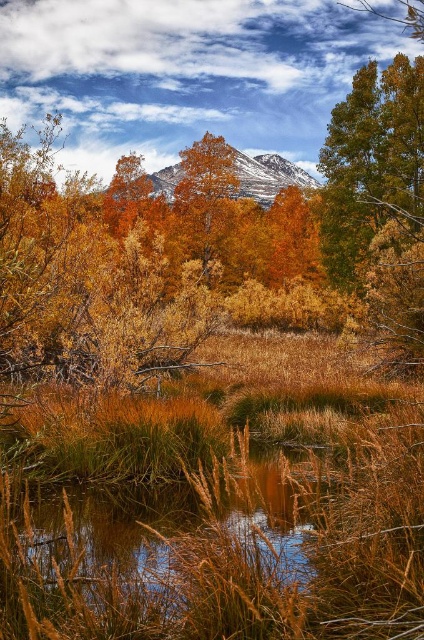
You are planning to take a photo of the golden textured tree at center and the snowy rock mountain at upper center. Since you want both subjects to be clearly visible in the frame, which object should you ensure is closer to the camera to avoid blurring due to its smaller size?

The golden textured tree at center has a smaller width than the snowy rock mountain at upper center, so you should position the golden textured tree at center closer to the camera to ensure both are visible and avoid blurring caused by size differences.

You are standing in the autumnal landscape and want to walk from the point closer to you to the farther point. Which path would you take between the two points labeled as point (x=201, y=156) and point (x=162, y=173)?

You should walk from point (x=201, y=156) to point (x=162, y=173) because point (x=201, y=156) is closer to the camera and you need to move towards the farther point.

From the picture: You are a hiker standing at the edge of the marshy area in the autumn landscape. You see the golden textured tree at center and the snowy rock mountain at upper center. Which object is taller?

The golden textured tree at center is much taller than the snowy rock mountain at upper center.